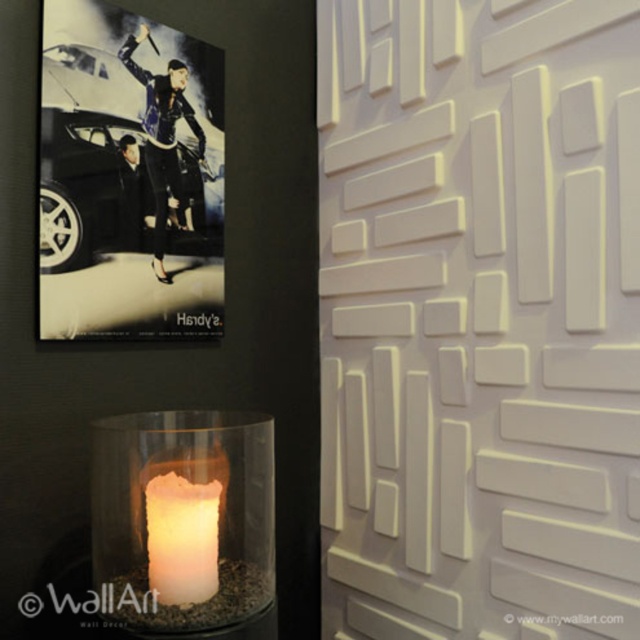
You are a delivery person trying to place a package between the framed poster and the black glossy car at upper left. The package requires at least 4 feet of space to fit. Can you fit the package there?

The distance between the framed poster and the black glossy car at upper left is 3.89 feet, which is less than the required 4 feet. Therefore, the package cannot be placed there.

You are an interior designer assessing the placement of the black glossy car at upper left and the ivory matte candle at lower left. Which object is closer to the viewer?

The black glossy car at upper left is closer to the viewer than the ivory matte candle at lower left based on their spatial arrangement in the scene.

You are an interior designer arranging a space with a black glossy car at upper left and an ivory matte candle at lower left. The distance between them is crucial for the ambiance. If the minimum required distance for optimal lighting is 24 inches, will the current placement work?

The black glossy car at upper left is 23.87 inches from the ivory matte candle at lower left. Since 23.87 inches is slightly less than the required 24 inches, the current placement is just below the optimal distance and may not achieve the desired ambiance.